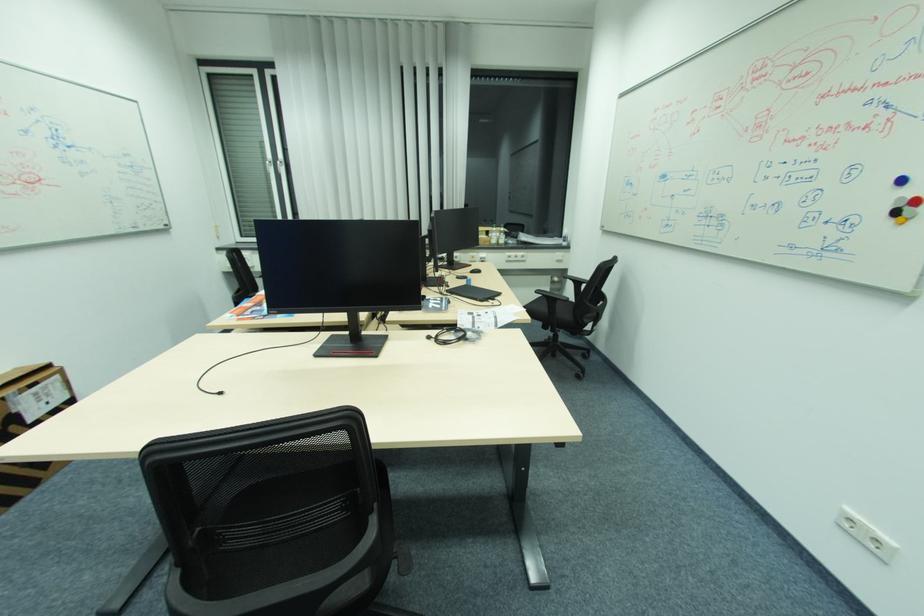
Describe the element at coordinates (915, 201) in the screenshot. The height and width of the screenshot is (616, 924). I see `the red round magnet` at that location.